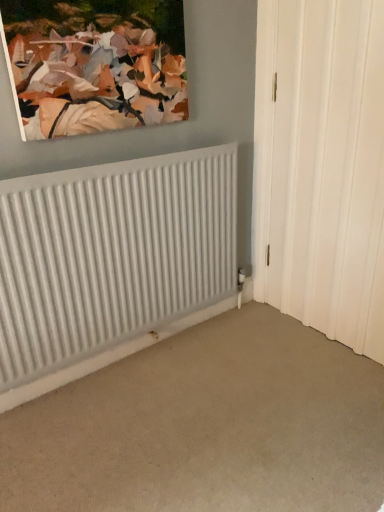
Question: Is matte canvas painting at upper left taller than white ribbed radiator at lower left?

Choices:
 (A) no
 (B) yes

Answer: (A)

Question: From a real-world perspective, is matte canvas painting at upper left beneath white ribbed radiator at lower left?

Choices:
 (A) yes
 (B) no

Answer: (B)

Question: Is matte canvas painting at upper left surrounding white ribbed radiator at lower left?

Choices:
 (A) yes
 (B) no

Answer: (B)

Question: Is matte canvas painting at upper left at the right side of white ribbed radiator at lower left?

Choices:
 (A) no
 (B) yes

Answer: (A)

Question: Does matte canvas painting at upper left have a larger size compared to white ribbed radiator at lower left?

Choices:
 (A) yes
 (B) no

Answer: (B)

Question: Considering their positions, is white textured door at right located in front of or behind white ribbed radiator at lower left?

Choices:
 (A) front
 (B) behind

Answer: (A)

Question: Is point (345, 50) closer or farther from the camera than point (135, 295)?

Choices:
 (A) closer
 (B) farther

Answer: (A)

Question: Based on their positions, is white textured door at right located to the left or right of white ribbed radiator at lower left?

Choices:
 (A) left
 (B) right

Answer: (B)

Question: From a real-world perspective, is white textured door at right above or below white ribbed radiator at lower left?

Choices:
 (A) below
 (B) above

Answer: (B)

Question: From the image's perspective, is white textured door at right located above or below matte canvas painting at upper left?

Choices:
 (A) above
 (B) below

Answer: (B)

Question: From a real-world perspective, is white textured door at right positioned above or below matte canvas painting at upper left?

Choices:
 (A) below
 (B) above

Answer: (A)

Question: Is white textured door at right in front of or behind matte canvas painting at upper left in the image?

Choices:
 (A) behind
 (B) front

Answer: (A)

Question: Is white textured door at right situated inside matte canvas painting at upper left or outside?

Choices:
 (A) outside
 (B) inside

Answer: (A)

Question: Is matte canvas painting at upper left taller or shorter than white ribbed radiator at lower left?

Choices:
 (A) short
 (B) tall

Answer: (A)

Question: Is point (125, 18) closer or farther from the camera than point (77, 258)?

Choices:
 (A) closer
 (B) farther

Answer: (A)